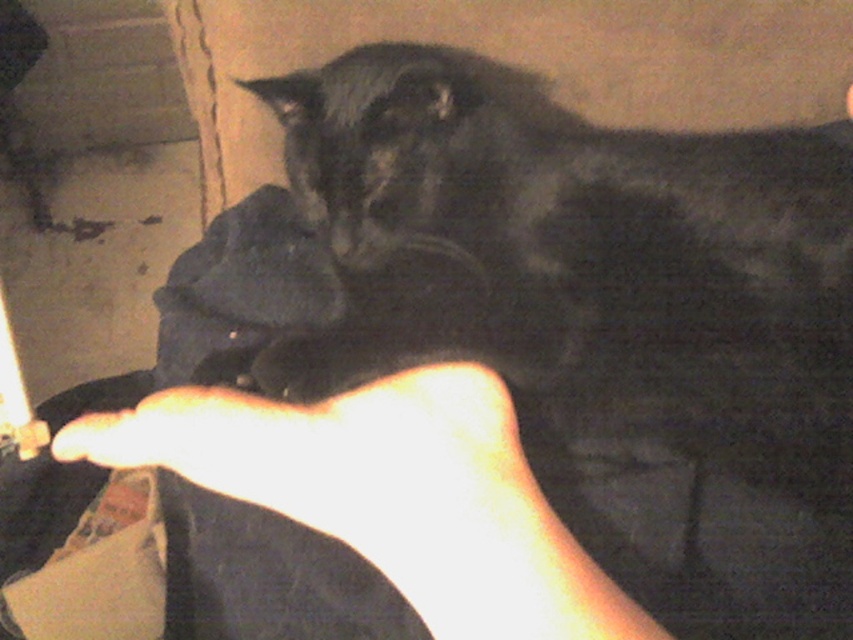
Question: Which of the following is the farthest from the observer?

Choices:
 (A) pos(497,476)
 (B) pos(792,408)

Answer: (B)

Question: Is black fur cat at center further to camera compared to light skin tone flesh at lower center?

Choices:
 (A) no
 (B) yes

Answer: (B)

Question: Which of the following is the farthest from the observer?

Choices:
 (A) (648, 193)
 (B) (428, 556)

Answer: (A)

Question: Is black fur cat at center closer to camera compared to light skin tone flesh at lower center?

Choices:
 (A) yes
 (B) no

Answer: (B)

Question: Is black fur cat at center behind light skin tone flesh at lower center?

Choices:
 (A) no
 (B) yes

Answer: (B)